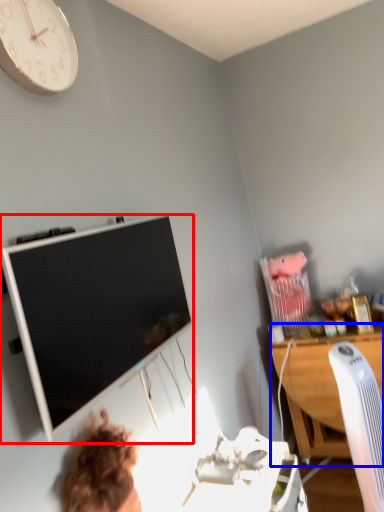
Question: Which object is closer to the camera taking this photo, television (highlighted by a red box) or desk (highlighted by a blue box)?

Choices:
 (A) television
 (B) desk

Answer: (A)